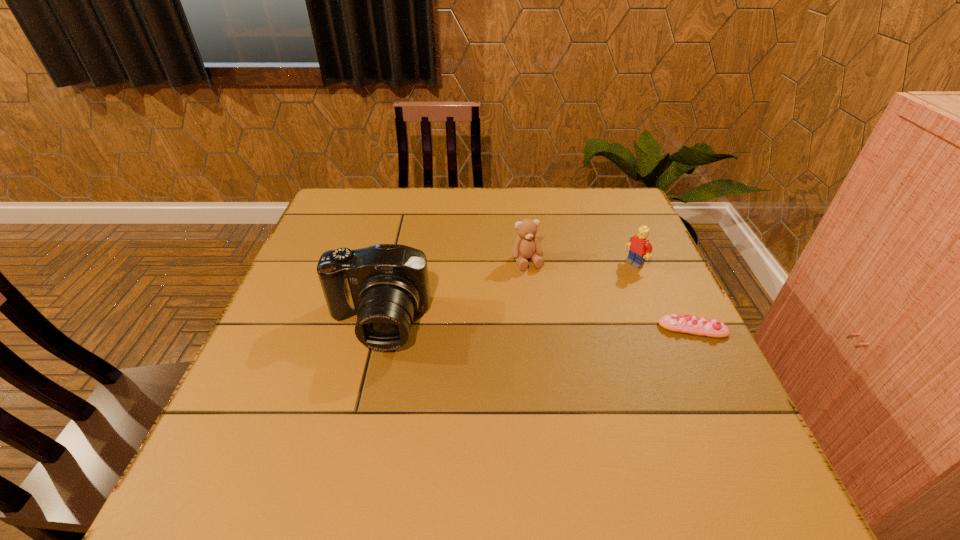
Image resolution: width=960 pixels, height=540 pixels. Identify the location of vacant spot on the desktop that is between the leftmost object and the shortest object and is positioned on the face of the teddy bear. (558, 327).

This screenshot has height=540, width=960. What are the coordinates of `free space on the desktop that is between the tallest object and the shortest object and is positioned on the front-facing side of the Lego` in the screenshot? It's located at (524, 326).